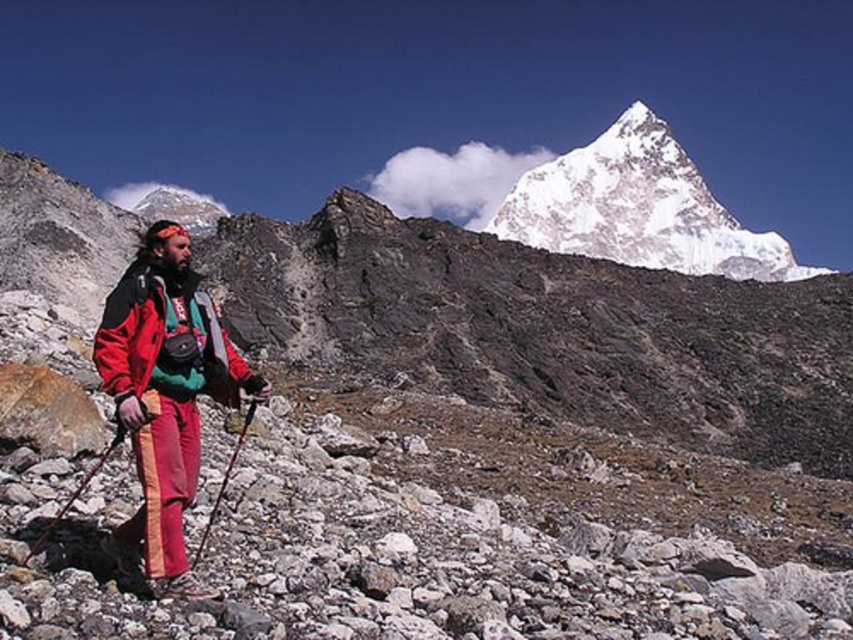
Question: Where is matte red jacket at center located in relation to wooden ski pole at lower left in the image?

Choices:
 (A) above
 (B) below

Answer: (A)

Question: Estimate the real-world distances between objects in this image. Which object is closer to the matte black ski pole at center?

Choices:
 (A) matte red ski suit at left
 (B) wooden ski pole at lower left

Answer: (A)

Question: Does matte red jacket at center appear under matte black ski pole at center?

Choices:
 (A) no
 (B) yes

Answer: (A)

Question: Which point appears farthest from the camera in this image?

Choices:
 (A) (782, 241)
 (B) (44, 529)
 (C) (236, 442)

Answer: (A)

Question: Does wooden ski pole at lower left have a larger size compared to matte black ski pole at center?

Choices:
 (A) no
 (B) yes

Answer: (A)

Question: Considering the real-world distances, which object is farthest from the white snow-covered peak at upper center?

Choices:
 (A) matte red ski suit at left
 (B) matte red jacket at center

Answer: (B)